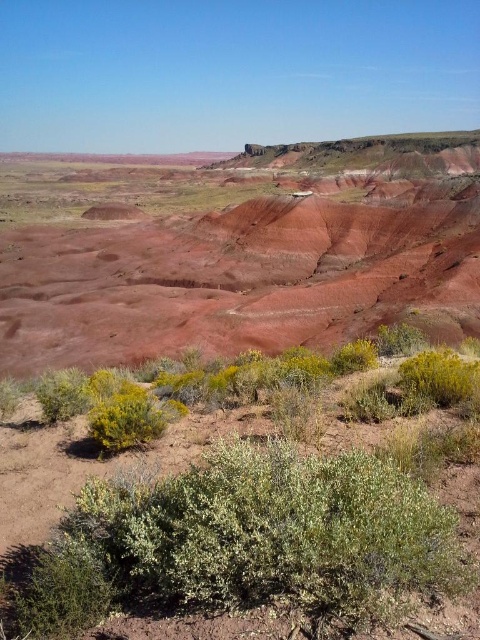
You are a desert explorer who needs to cross from the rustic clay hillside at center to the green leafy bush at lower right. Given that your water supply is limited and you can only walk 100 meters before needing to rest, how many rest stops will you need to make between the two locations?

The distance between the rustic clay hillside at center and the green leafy bush at lower right is 242.67 meters. Since you can only walk 100 meters before resting, you will need to rest after the first 100 meters and again after another 100 meters, totaling 2 rest stops. However, since the total distance is 242.67 meters, after two rest stops, you would have covered 200 meters, leaving 42.67 meters remaining. Therefore, you would need to make 2 rest stops before reaching the destination.

You are standing at the origin point in the desert scene. Based on the coordinates provided, where exactly is the rustic clay hillside at center located?

The rustic clay hillside at center is located at the coordinates point (239, 250).